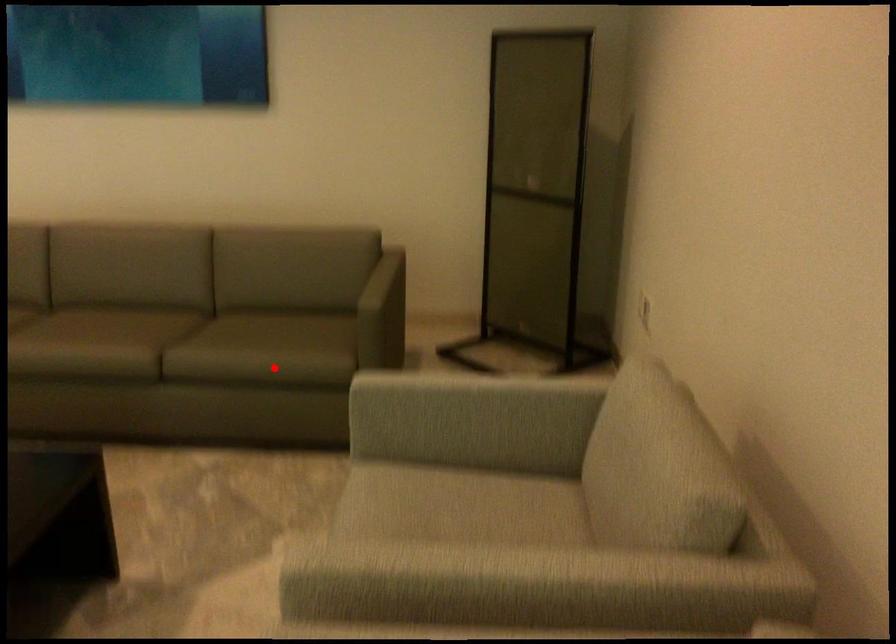
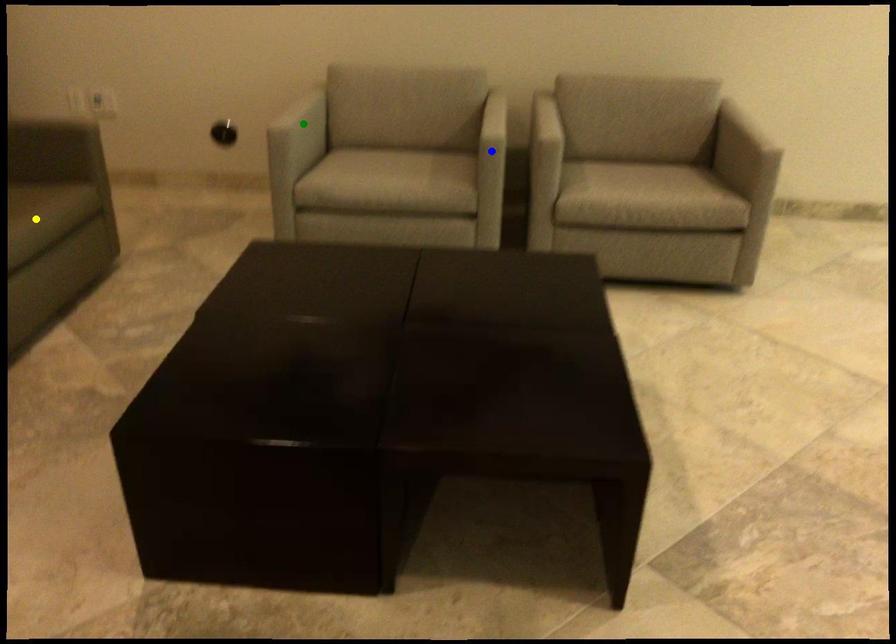
Question: I am providing you with two images of the same scene from different viewpoints. A red point is marked on the first image. You are given multiple points on the second image. Which point in image 2 represents the same 3d spot as the red point in image 1?

Choices:
 (A) blue point
 (B) green point
 (C) yellow point

Answer: (C)